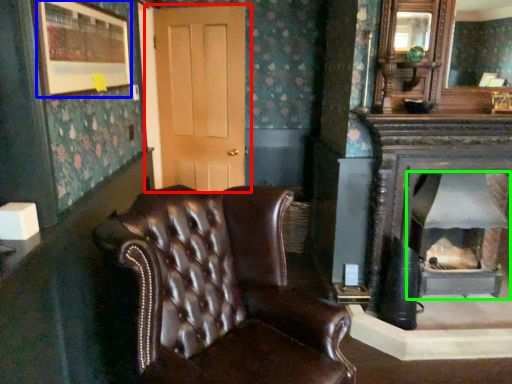
Question: Which is farther away from door (highlighted by a red box)? picture frame (highlighted by a blue box) or wood burning stove (highlighted by a green box)?

Choices:
 (A) picture frame
 (B) wood burning stove

Answer: (B)